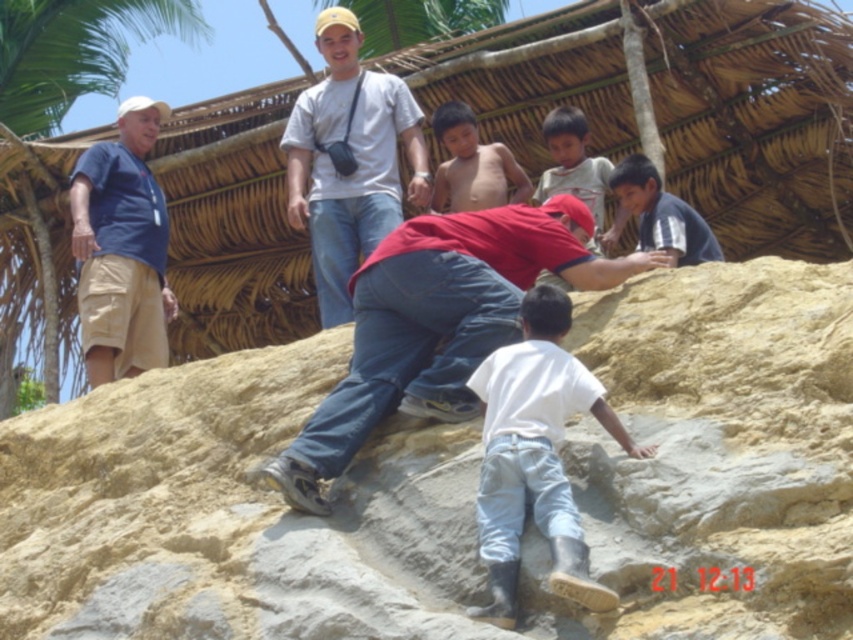
Between skinny bare torso at center and light brown skin at upper center, which one has more height?

Standing taller between the two is light brown skin at upper center.

Can you confirm if skinny bare torso at center is positioned above light brown skin at upper center?

Correct, skinny bare torso at center is located above light brown skin at upper center.

Measure the distance between skinny bare torso at center and camera.

skinny bare torso at center is 70.70 meters from camera.

Locate an element on the screen. skinny bare torso at center is located at coordinates (473, 164).

The height and width of the screenshot is (640, 853). What do you see at coordinates (439, 323) in the screenshot? I see `denim jeans at center` at bounding box center [439, 323].

Between point (352, 278) and point (619, 204), which one is positioned in front?

Point (352, 278)

Find the location of a particular element. denim jeans at center is located at coordinates (439, 323).

Is green leafy palm tree at upper left further to camera compared to light brown skin at upper center?

Yes, green leafy palm tree at upper left is further from the viewer.

Does green leafy palm tree at upper left appear under light brown skin at upper center?

Incorrect, green leafy palm tree at upper left is not positioned below light brown skin at upper center.

Does point (172, 29) come closer to viewer compared to point (590, 204)?

No.

Find the location of a particular element. This screenshot has width=853, height=640. green leafy palm tree at upper left is located at coordinates (73, 56).